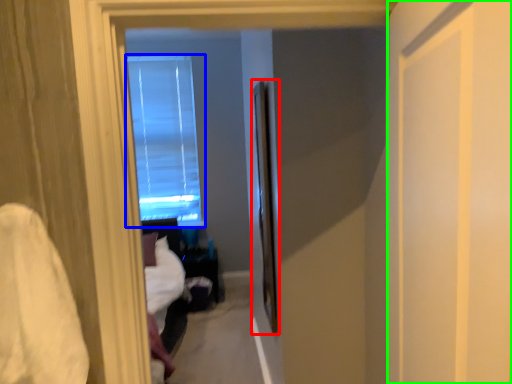
Question: Based on their relative distances, which object is farther from screen door (highlighted by a red box)? Choose from window (highlighted by a blue box) and screen door (highlighted by a green box).

Choices:
 (A) window
 (B) screen door

Answer: (A)